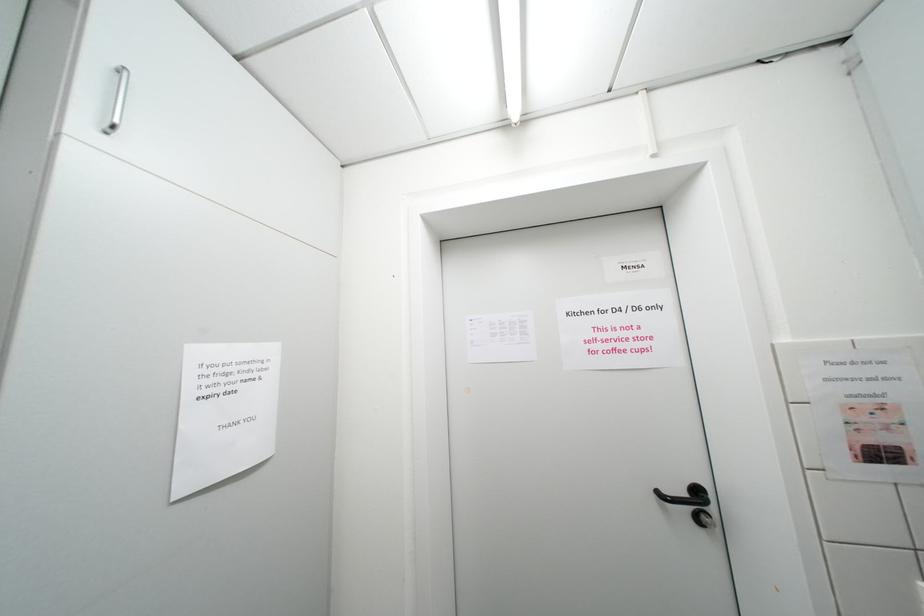
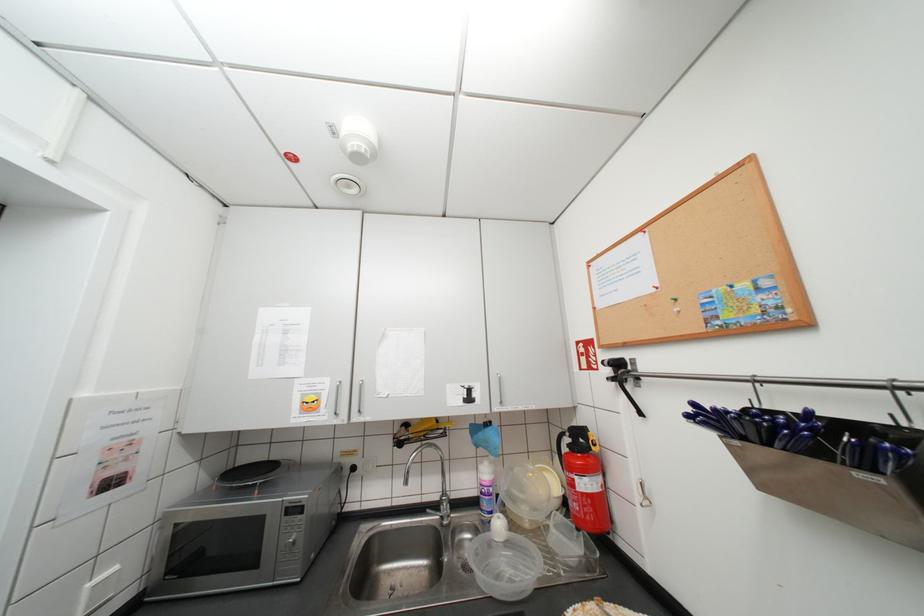
The images are taken continuously from a first-person perspective. In which direction is your viewpoint rotating?

The camera rotated toward right-up.